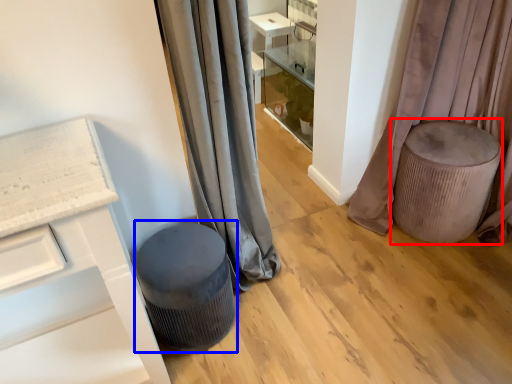
Question: Which object is further to the camera taking this photo, swivel chair (highlighted by a red box) or music stool (highlighted by a blue box)?

Choices:
 (A) swivel chair
 (B) music stool

Answer: (A)